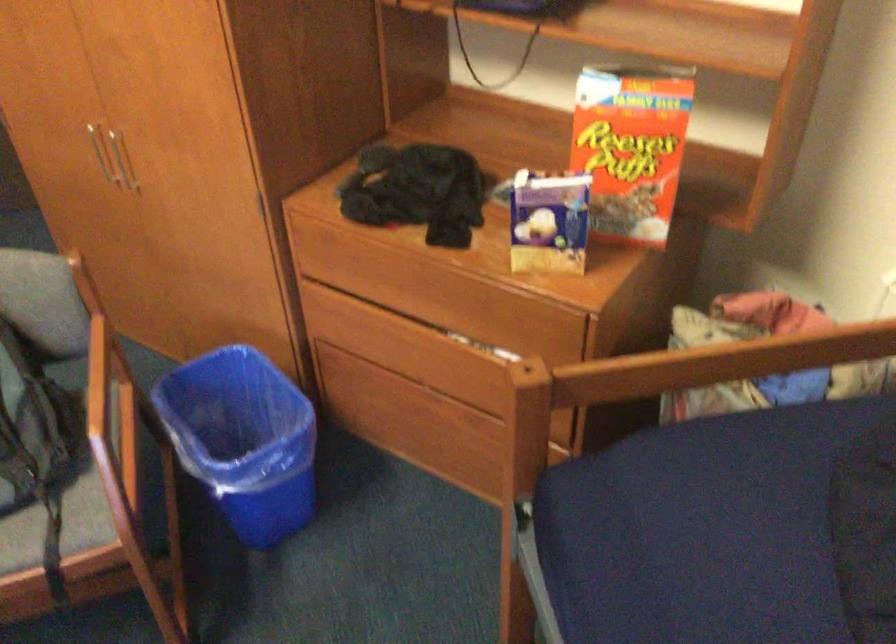
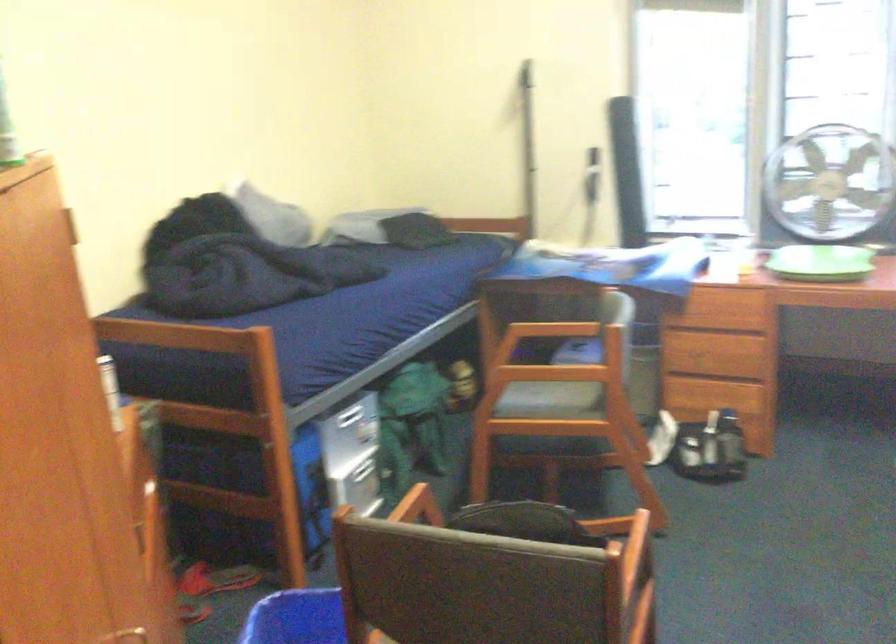
Question: I am providing you with two images of the same scene from different viewpoints. After the viewpoint changes to image2, which objects are now occluded?

Choices:
 (A) silver drawer handle
 (B) water bottle sensor
 (C) drawer pull
 (D) wooden chair armrest

Answer: (C)